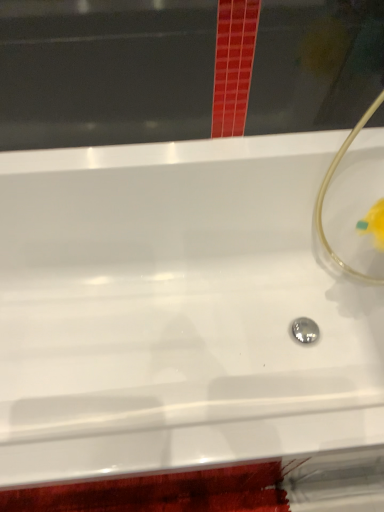
Identify the location of white glossy sink at center. (176, 310).

This screenshot has width=384, height=512. What do you see at coordinates (176, 310) in the screenshot?
I see `white glossy sink at center` at bounding box center [176, 310].

Where is `white glossy sink at center`? white glossy sink at center is located at coordinates (176, 310).